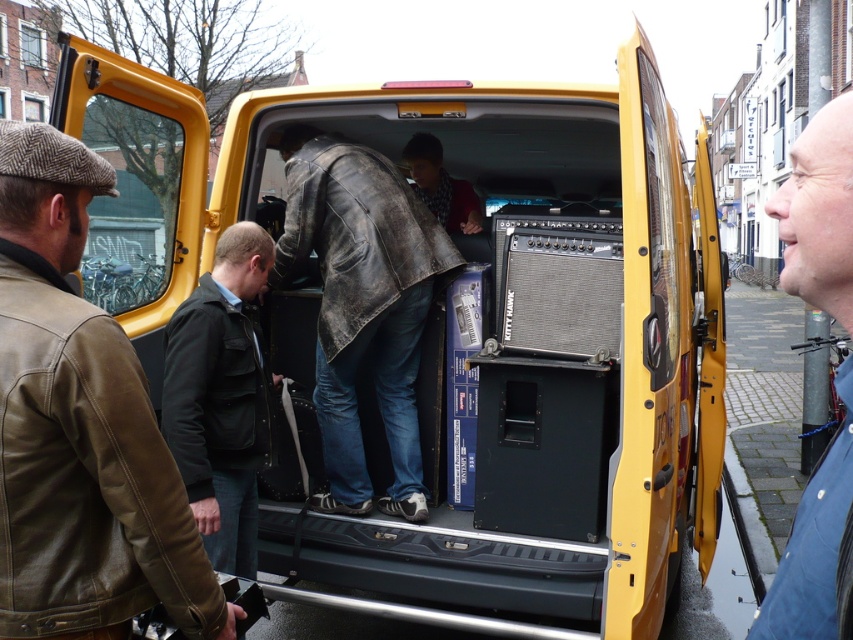
Does brown leather jacket at left have a greater height compared to black leather jacket at center?

No.

How far apart are brown leather jacket at left and black leather jacket at center?

brown leather jacket at left and black leather jacket at center are 3.50 feet apart.

Does point (27, 474) lie behind point (247, 392)?

No, (27, 474) is closer to viewer.

Locate an element on the screen. brown leather jacket at left is located at coordinates (80, 428).

Is brown leather jacket at left positioned before leather jacket at center?

Yes, brown leather jacket at left is closer to the viewer.

Identify the location of brown leather jacket at left. The height and width of the screenshot is (640, 853). (80, 428).

Find the location of a particular element. The width and height of the screenshot is (853, 640). brown leather jacket at left is located at coordinates (80, 428).

Can you confirm if black leather jacket at center is positioned below blue denim jacket at lower right?

Correct, black leather jacket at center is located below blue denim jacket at lower right.

Can you confirm if black leather jacket at center is positioned to the right of blue denim jacket at lower right?

No, black leather jacket at center is not to the right of blue denim jacket at lower right.

Where is `black leather jacket at center`? Image resolution: width=853 pixels, height=640 pixels. black leather jacket at center is located at coordinates (219, 397).